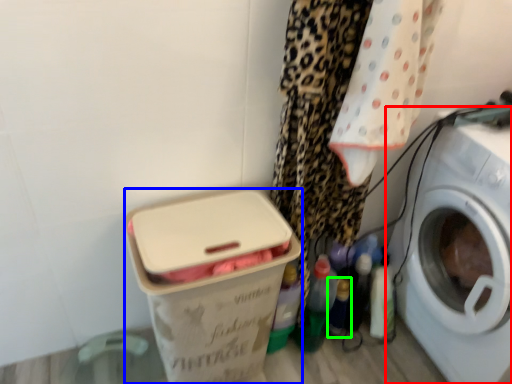
Question: Which object is the closest to the washing machine (highlighted by a red box)? Choose among these: box (highlighted by a blue box) or bottle (highlighted by a green box).

Choices:
 (A) box
 (B) bottle

Answer: (B)